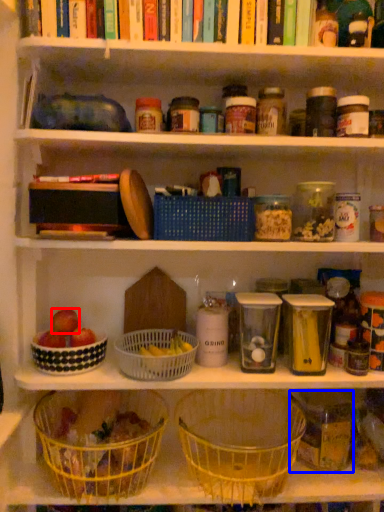
Question: Which object is closer to the camera taking this photo, apple (highlighted by a red box) or glass jar (highlighted by a blue box)?

Choices:
 (A) apple
 (B) glass jar

Answer: (B)